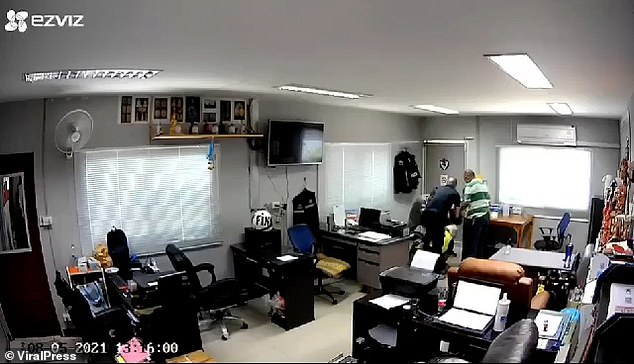
What are the coordinates of `door` in the screenshot? It's located at (15, 289).